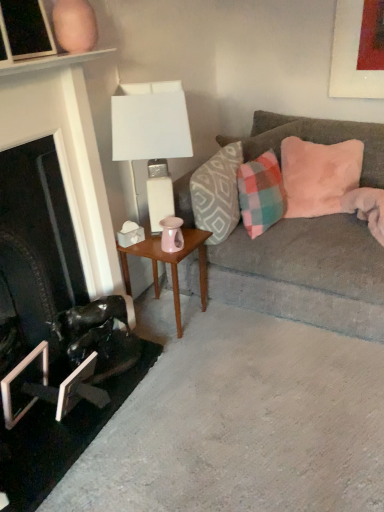
In order to click on free space that is in between shiny black swivel chair at lower left and metallic silver picture frame at lower left, which ranks as the 3th picture frame in top-to-bottom order in this screenshot , I will do `click(115, 385)`.